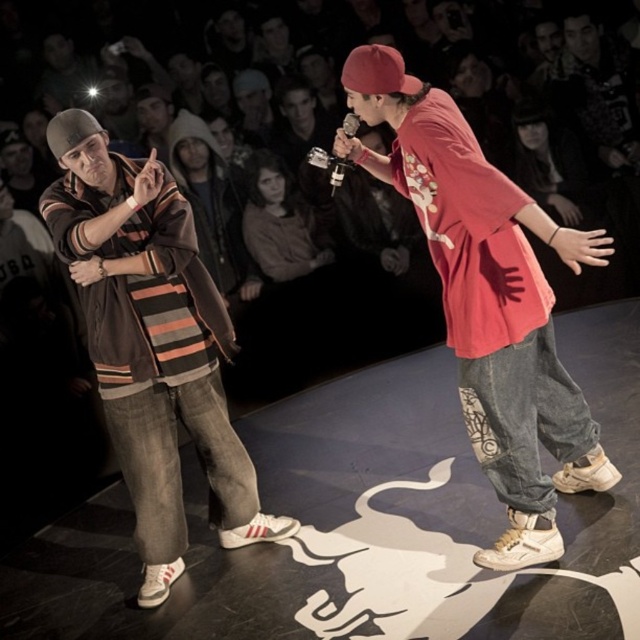
Question: Which point is closer to the camera taking this photo?

Choices:
 (A) tap(376, 61)
 (B) tap(176, 392)

Answer: (A)

Question: Which object is the farthest from the matte red shirt at center?

Choices:
 (A) striped cotton shirt at left
 (B) red cotton baseball cap at upper center

Answer: (A)

Question: Is matte red shirt at center further to the viewer compared to red cotton baseball cap at upper center?

Choices:
 (A) yes
 (B) no

Answer: (B)

Question: Can you confirm if striped cotton shirt at left is positioned to the right of red cotton baseball cap at upper center?

Choices:
 (A) yes
 (B) no

Answer: (B)

Question: Among these objects, which one is nearest to the camera?

Choices:
 (A) red cotton baseball cap at upper center
 (B) striped cotton shirt at left
 (C) matte red shirt at center

Answer: (C)

Question: Does matte red shirt at center appear on the right side of striped cotton shirt at left?

Choices:
 (A) yes
 (B) no

Answer: (A)